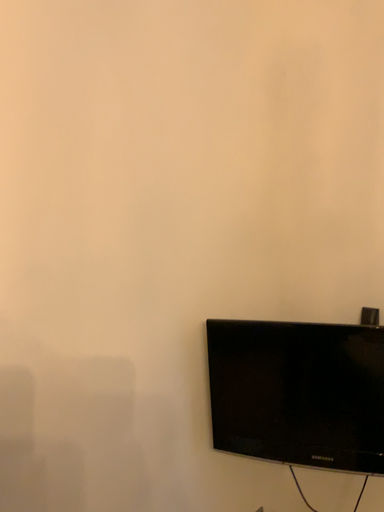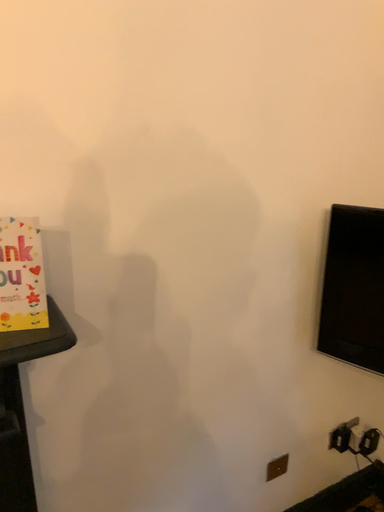
Question: Which way did the camera rotate in the video?

Choices:
 (A) rotated upward
 (B) rotated downward

Answer: (B)